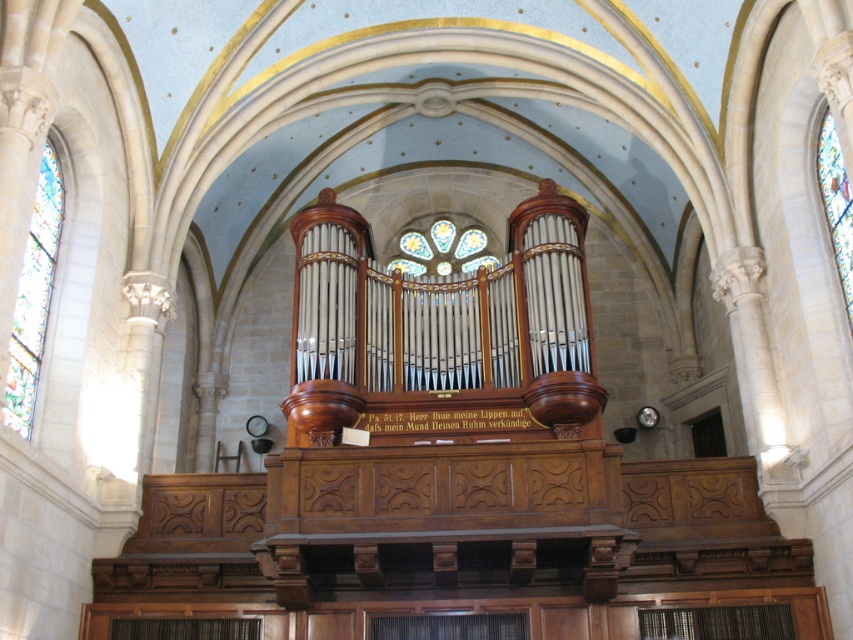
You are standing in the church and looking at the pipe organ. There are two points marked on the organ. One is at coordinate point (27, 337) and the other is at coordinate point (828, 230). Which point is closer to you?

Point (27, 337) is closer to the camera than point (828, 230).

Consider the image. You are standing inside a church and want to take a photo of the pipe organ. The camera you are using has a focal length of 50 meters. Is the point at coordinates point (22,404) within the camera focus range?

The point at coordinates point (22,404) is 50.90 meters from the camera. Since the camera has a focal length of 50 meters, the point is slightly beyond the camera focus range.

You are an architect designing a new church. You want to install a new light fixture between the stained glass at left and the stained glass window at right. Based on their positions, where should you place the new light fixture?

The stained glass at left is below the stained glass window at right, so the new light fixture should be placed above the stained glass at left and below the stained glass window at right to maintain proper positioning between them.